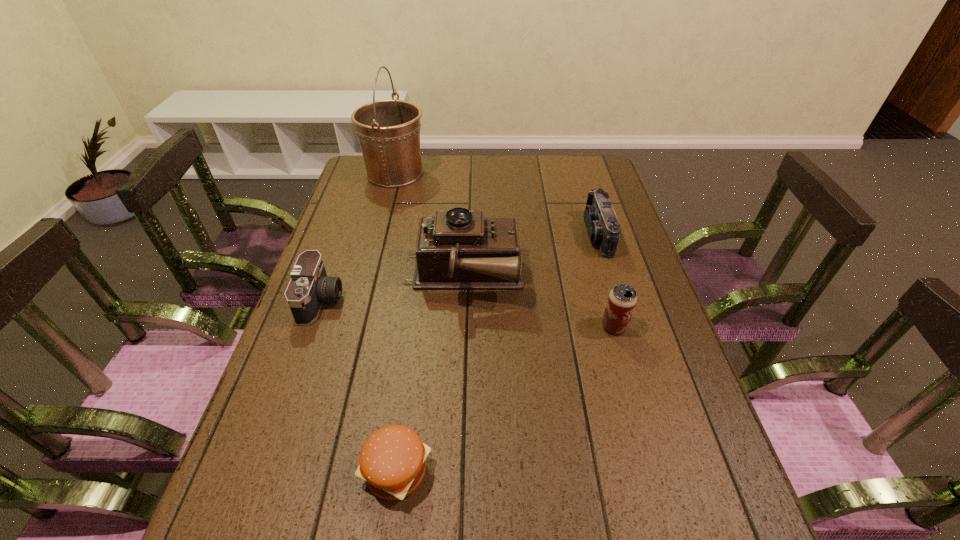
What are the coordinates of `vacant area situated on the front of the beer can` in the screenshot? It's located at (653, 464).

Locate an element on the screen. This screenshot has height=540, width=960. free space located 0.350m on the front-facing side of the camcorder is located at coordinates (470, 234).

This screenshot has height=540, width=960. I want to click on vacant space positioned 0.190m on the front-facing side of the camcorder, so click(x=522, y=234).

Identify the location of blank space located on the front-facing side of the camcorder. Image resolution: width=960 pixels, height=540 pixels. (513, 234).

You are a GUI agent. You are given a task and a screenshot of the screen. Output one action in this format:
    pyautogui.click(x=<x>, y=<y>)
    Task: Click on the vacant space located 0.140m on the front-facing side of the camera
    
    Given the screenshot: What is the action you would take?
    pyautogui.click(x=396, y=300)

This screenshot has width=960, height=540. In order to click on free space located 0.160m on the left of the shortest object in this screenshot , I will do `click(276, 471)`.

The image size is (960, 540). What are the coordinates of `object at the far edge` in the screenshot? It's located at (388, 131).

Identify the location of bucket that is at the left edge. This screenshot has width=960, height=540. (388, 131).

You are a GUI agent. You are given a task and a screenshot of the screen. Output one action in this format:
    pyautogui.click(x=<x>, y=<y>)
    Task: Click on the camera at the left edge
    
    Given the screenshot: What is the action you would take?
    pyautogui.click(x=309, y=287)

Image resolution: width=960 pixels, height=540 pixels. Find the location of `beer can situated at the right edge`. beer can situated at the right edge is located at coordinates (622, 299).